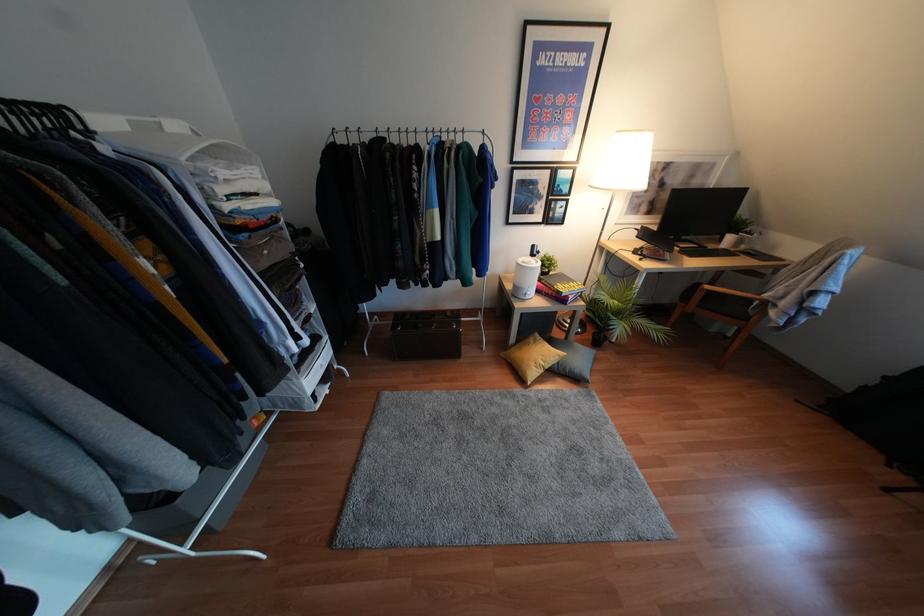
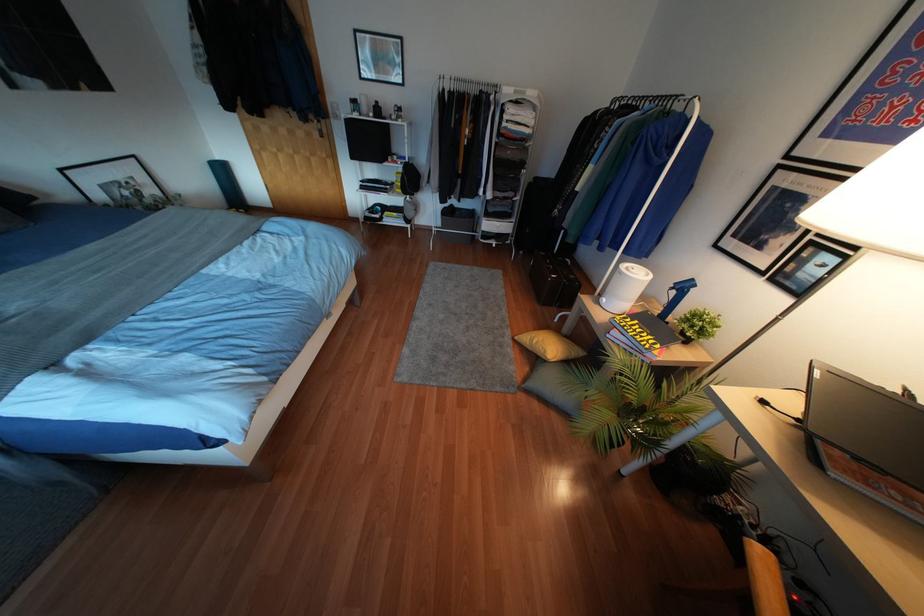
The point at (541, 363) is marked in the first image. Where is the corresponding point in the second image?

(533, 341)